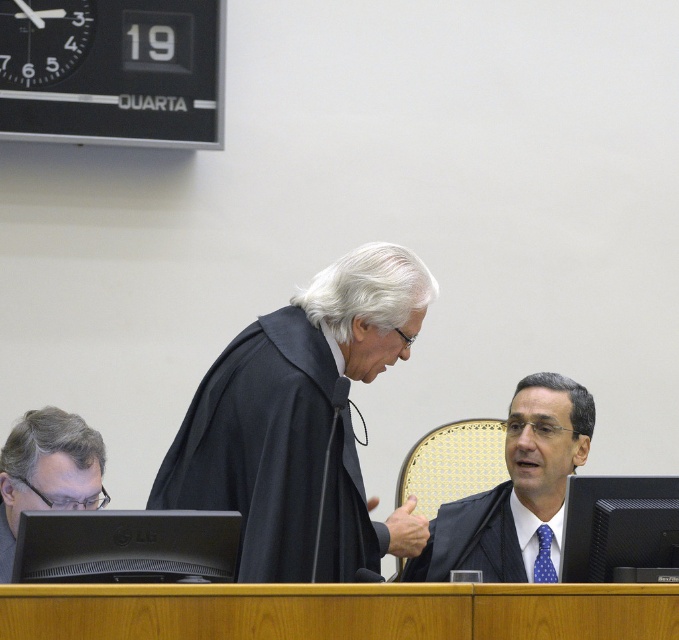
In the courtroom scene, you notice the black matte robe at center and the gray matte glasses at lower left. Which object is positioned higher in the image?

The black matte robe at center is positioned higher than the gray matte glasses at lower left.

You are a photographer standing at the camera position. You want to take a closeup shot of the black matte robe at center. Can you estimate how far you need to move forward to get the robe to fill the frame?

The black matte robe at center is 8.56 feet from camera. To get a closeup, you need to move forward approximately 2.5 feet to reduce the distance to about 6 feet, which is ideal for a headshot.

In the courtroom scene, you see a black matte robe at center and a black glossy suit at center. Which one is taller?

The black matte robe at center is taller than the black glossy suit at center.